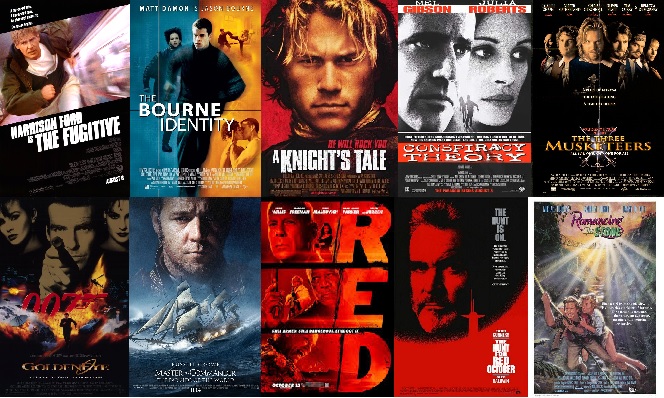
Find the location of a particular element. This screenshot has height=398, width=664. movie posters is located at coordinates (90, 102), (207, 108), (336, 120), (433, 105), (592, 100), (578, 247), (461, 252), (352, 269), (194, 279), (62, 298).